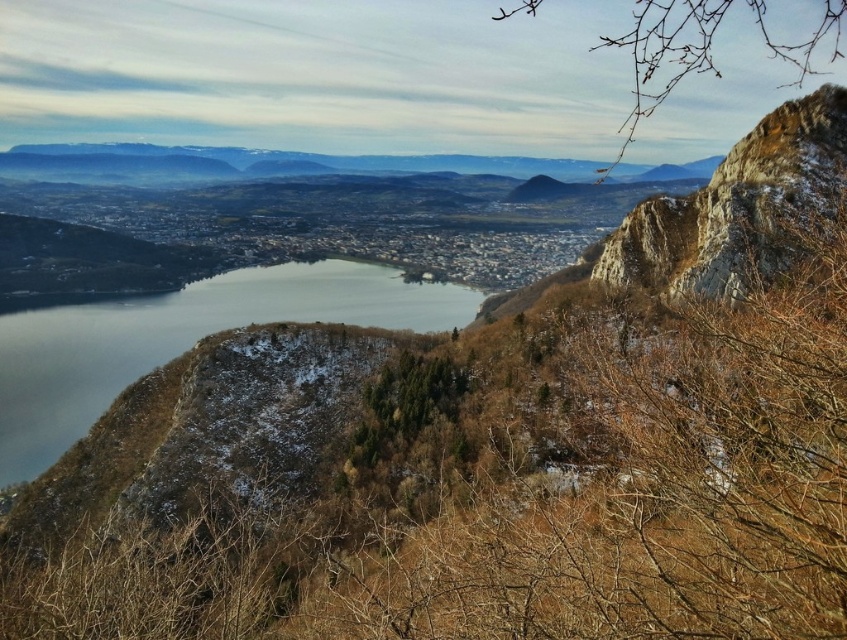
Which of these two, clear glass water at center or rocky cliff at upper right, stands shorter?

With less height is rocky cliff at upper right.

Which is in front, point (56, 340) or point (635, 211)?

Point (635, 211) is more forward.

You are a GUI agent. You are given a task and a screenshot of the screen. Output one action in this format:
    pyautogui.click(x=<x>, y=<y>)
    Task: Click on the clear glass water at center
    This screenshot has width=847, height=640.
    Given the screenshot: What is the action you would take?
    pyautogui.click(x=180, y=340)